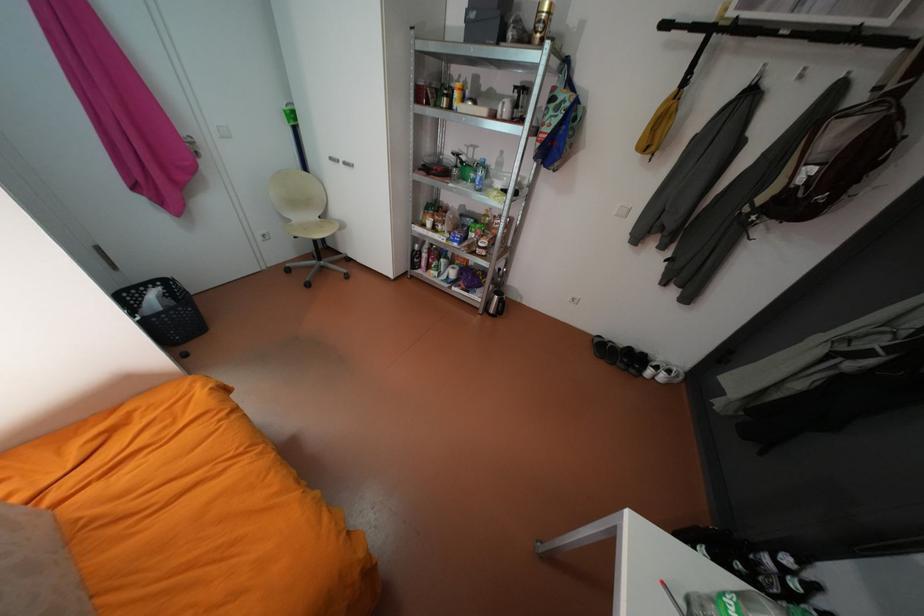
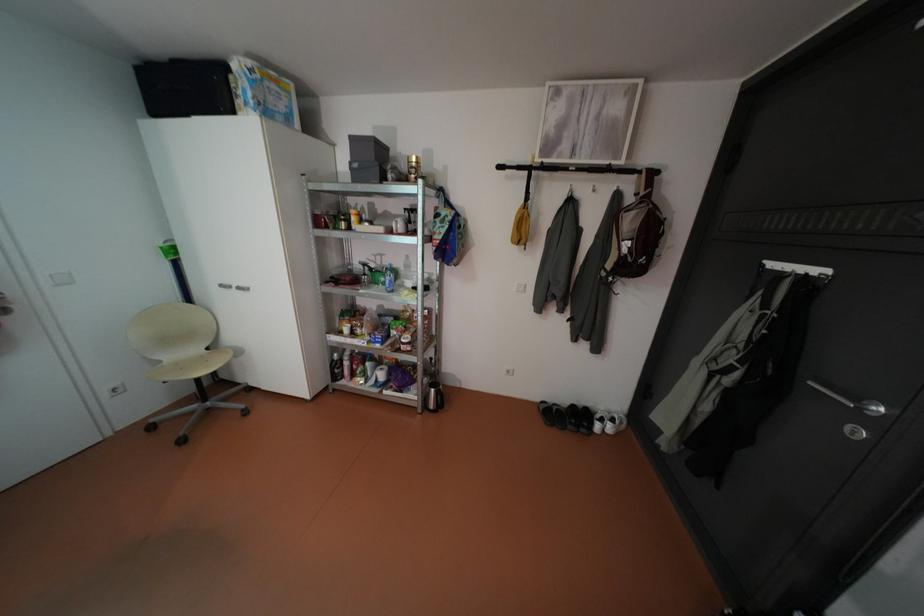
Question: The images are taken continuously from a first-person perspective. In which direction are you moving?

Choices:
 (A) Left
 (B) Right
 (C) Forward
 (D) Backward

Answer: (B)